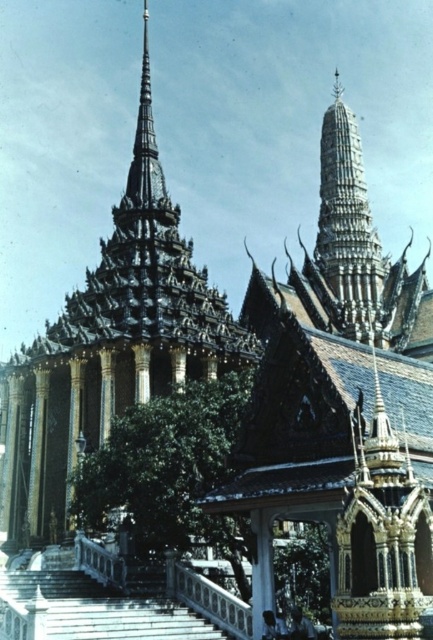
Which is above, shiny gold spire at center or silver metallic spire at center?

shiny gold spire at center

Is shiny gold spire at center shorter than silver metallic spire at center?

Incorrect, shiny gold spire at center's height does not fall short of silver metallic spire at center's.

Where is `shiny gold spire at center`? Image resolution: width=433 pixels, height=640 pixels. shiny gold spire at center is located at coordinates (109, 346).